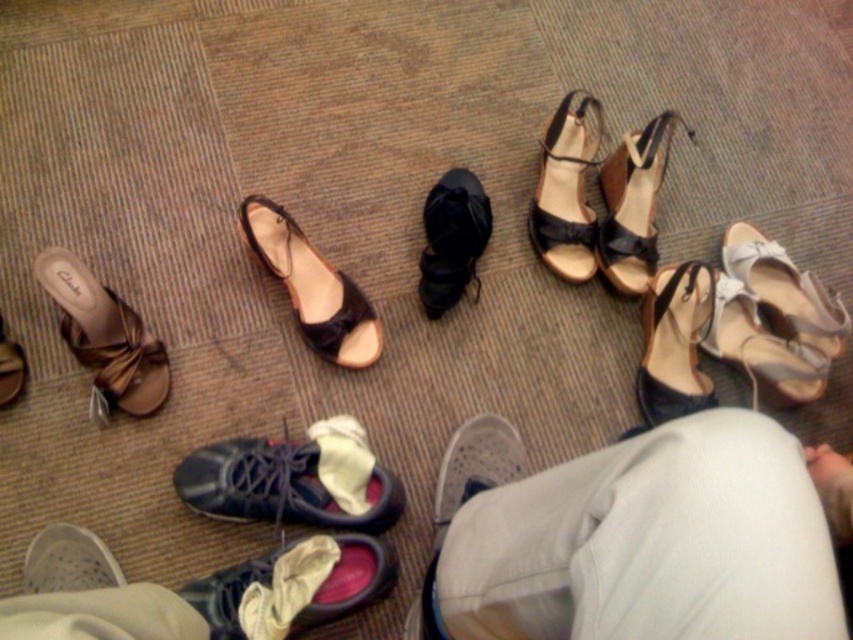
Question: Considering the real-world distances, which object is closest to the shiny black sneaker at lower center?

Choices:
 (A) black leather shoe at center
 (B) matte black sandal at center
 (C) leather sandal at upper right

Answer: (B)

Question: Does black leather sandal at lower right have a smaller size compared to matte brown sandal at upper left?

Choices:
 (A) no
 (B) yes

Answer: (A)

Question: Is black leather sandal at lower right to the left of white mesh sneaker at lower center from the viewer's perspective?

Choices:
 (A) yes
 (B) no

Answer: (B)

Question: Among these objects, which one is farthest from the camera?

Choices:
 (A) white mesh sneaker at lower center
 (B) matte brown sandal at upper left
 (C) white mesh shoe at lower left

Answer: (B)

Question: Which of these objects is positioned farthest from the black leather sandal at lower right?

Choices:
 (A) black leather sandals at upper center
 (B) matte black sandal at center
 (C) leather sandal at upper right

Answer: (B)

Question: Can you confirm if dark blue leather shoe at center is bigger than black leather shoe at center?

Choices:
 (A) yes
 (B) no

Answer: (A)